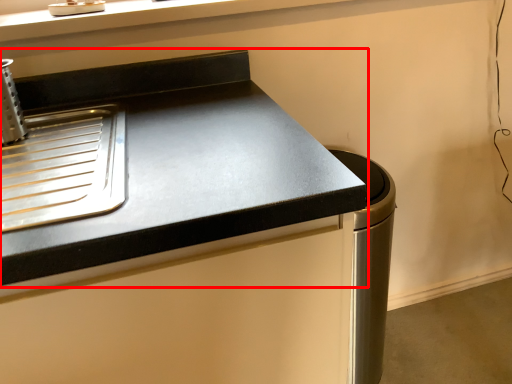
Question: From the image's perspective, what is the correct spatial positioning of countertop (annotated by the red box) in reference to appliance?

Choices:
 (A) above
 (B) below

Answer: (B)